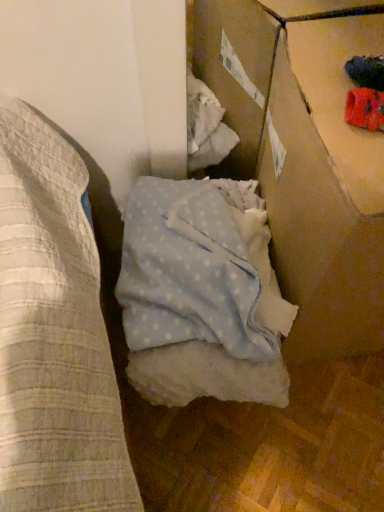
Question: Is point (241, 282) positioned closer to the camera than point (271, 181)?

Choices:
 (A) closer
 (B) farther

Answer: (A)

Question: Based on their sizes in the image, would you say light blue polka dot fabric at center is bigger or smaller than cardboard box at upper right?

Choices:
 (A) big
 (B) small

Answer: (B)

Question: From their relative heights in the image, would you say light blue polka dot fabric at center is taller or shorter than cardboard box at upper right?

Choices:
 (A) short
 (B) tall

Answer: (A)

Question: From the image's perspective, relative to light blue polka dot fabric at center, is cardboard box at upper right above or below?

Choices:
 (A) below
 (B) above

Answer: (B)

Question: In terms of width, does cardboard box at upper right look wider or thinner when compared to light blue polka dot fabric at center?

Choices:
 (A) thin
 (B) wide

Answer: (A)

Question: Considering their positions, is cardboard box at upper right located in front of or behind light blue polka dot fabric at center?

Choices:
 (A) front
 (B) behind

Answer: (A)

Question: Is point (327, 168) closer or farther from the camera than point (215, 325)?

Choices:
 (A) closer
 (B) farther

Answer: (A)